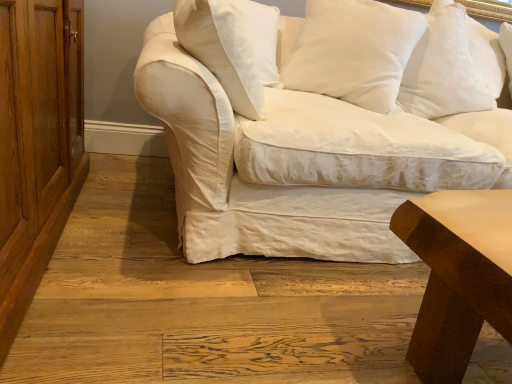
Question: Is the depth of wooden dresser at left greater than that of white cotton pillow at upper right, which appears as the third pillow when viewed from the left?

Choices:
 (A) no
 (B) yes

Answer: (A)

Question: Considering the relative sizes of wooden dresser at left and white cotton pillow at upper right, which appears as the third pillow when viewed from the left, in the image provided, is wooden dresser at left taller than white cotton pillow at upper right, which appears as the third pillow when viewed from the left,?

Choices:
 (A) yes
 (B) no

Answer: (A)

Question: Is white cotton pillow at upper right, which is the second pillow from right to left, completely or partially inside wooden dresser at left?

Choices:
 (A) no
 (B) yes

Answer: (A)

Question: From the image's perspective, does wooden dresser at left appear higher than white cotton pillow at upper right, which appears as the third pillow when viewed from the left?

Choices:
 (A) yes
 (B) no

Answer: (B)

Question: From the image's perspective, does wooden dresser at left appear lower than white cotton pillow at upper right, which is the second pillow from right to left?

Choices:
 (A) yes
 (B) no

Answer: (A)

Question: From a real-world perspective, is wooden dresser at left located beneath white cotton pillow at upper right, which appears as the third pillow when viewed from the left?

Choices:
 (A) no
 (B) yes

Answer: (B)

Question: Is wooden dresser at left inside white cotton pillow at upper right, which appears as the third pillow when viewed from the left?

Choices:
 (A) no
 (B) yes

Answer: (A)

Question: Does white cotton pillow at upper right, which appears as the third pillow when viewed from the left, have a smaller size compared to wooden dresser at left?

Choices:
 (A) yes
 (B) no

Answer: (A)

Question: From the image's perspective, is white cotton pillow at upper right, which is the second pillow from right to left, beneath wooden dresser at left?

Choices:
 (A) no
 (B) yes

Answer: (A)

Question: Does white cotton pillow at upper right, which appears as the third pillow when viewed from the left, appear on the right side of wooden dresser at left?

Choices:
 (A) no
 (B) yes

Answer: (B)

Question: Can you confirm if white cotton pillow at upper right, which is the second pillow from right to left, is bigger than wooden dresser at left?

Choices:
 (A) yes
 (B) no

Answer: (B)

Question: Are white cotton pillow at upper right, which is the second pillow from right to left, and wooden dresser at left located far from each other?

Choices:
 (A) no
 (B) yes

Answer: (B)

Question: Is white cotton couch at center at the back of smooth brown wood table at lower right?

Choices:
 (A) yes
 (B) no

Answer: (A)